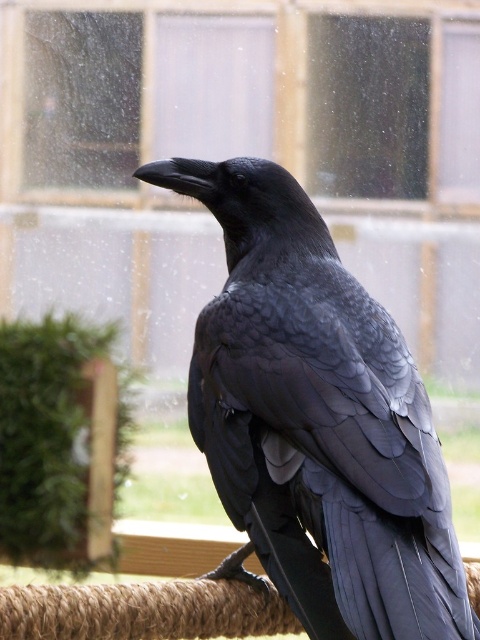
Question: In this image, where is transparent glass window at upper center located relative to black feathered raven at center?

Choices:
 (A) right
 (B) left

Answer: (B)

Question: Which of the following is the farthest from the observer?

Choices:
 (A) black feathered raven at center
 (B) transparent glass window at upper center

Answer: (B)

Question: Which point is farther from the camera taking this photo?

Choices:
 (A) click(111, 166)
 (B) click(372, 305)

Answer: (A)

Question: Is transparent glass window at upper center further to camera compared to black feathered raven at center?

Choices:
 (A) yes
 (B) no

Answer: (A)

Question: Is transparent glass window at upper center behind black feathered raven at center?

Choices:
 (A) yes
 (B) no

Answer: (A)